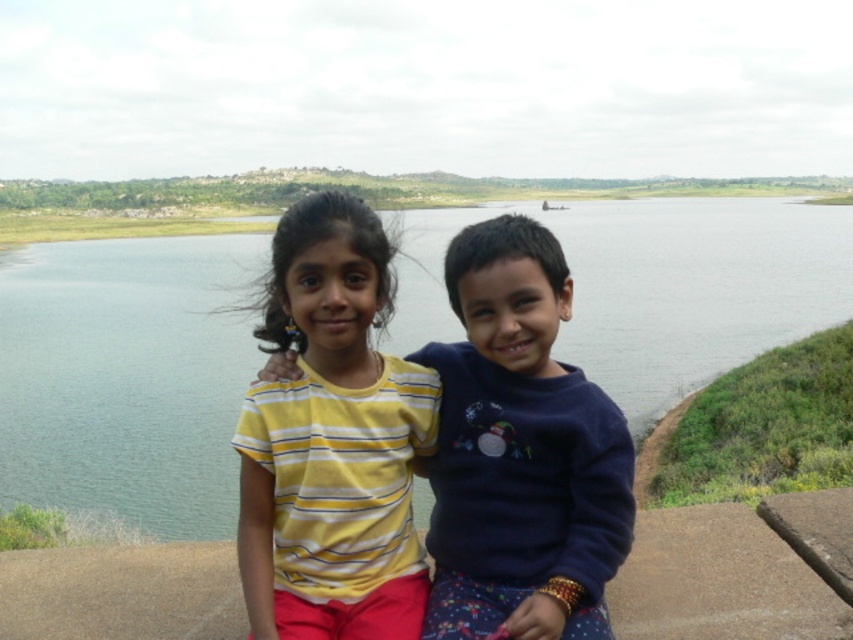
Question: Which point is closer to the camera?

Choices:
 (A) dark blue sweater at center
 (B) yellow striped shirt at center

Answer: (A)

Question: Which object is the farthest from the blue water at center?

Choices:
 (A) yellow striped shirt at center
 (B) dark blue sweater at center

Answer: (A)

Question: Which point appears farthest from the camera in this image?

Choices:
 (A) (535, 420)
 (B) (277, 600)

Answer: (A)

Question: Is yellow striped shirt at center thinner than dark blue sweater at center?

Choices:
 (A) no
 (B) yes

Answer: (A)

Question: Where is blue water at center located in relation to dark blue sweater at center in the image?

Choices:
 (A) above
 (B) below

Answer: (A)

Question: Does yellow striped shirt at center have a larger size compared to dark blue sweater at center?

Choices:
 (A) yes
 (B) no

Answer: (A)